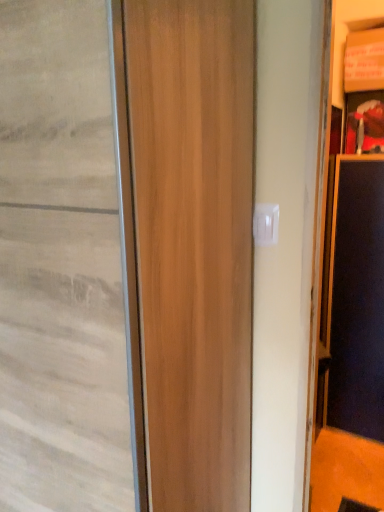
Question: Considering the positions of black matte screen door at right and wooden door at center in the image, is black matte screen door at right bigger or smaller than wooden door at center?

Choices:
 (A) small
 (B) big

Answer: (A)

Question: Considering the positions of black matte screen door at right and wooden door at center in the image, is black matte screen door at right wider or thinner than wooden door at center?

Choices:
 (A) wide
 (B) thin

Answer: (B)

Question: From the image's perspective, relative to wooden door at center, is black matte screen door at right above or below?

Choices:
 (A) above
 (B) below

Answer: (B)

Question: Is wooden door at center in front of or behind black matte screen door at right in the image?

Choices:
 (A) behind
 (B) front

Answer: (B)

Question: Is wooden door at center taller or shorter than black matte screen door at right?

Choices:
 (A) short
 (B) tall

Answer: (B)

Question: Is point (69, 343) positioned closer to the camera than point (355, 350)?

Choices:
 (A) farther
 (B) closer

Answer: (B)

Question: Based on their sizes in the image, would you say wooden door at center is bigger or smaller than black matte screen door at right?

Choices:
 (A) small
 (B) big

Answer: (B)